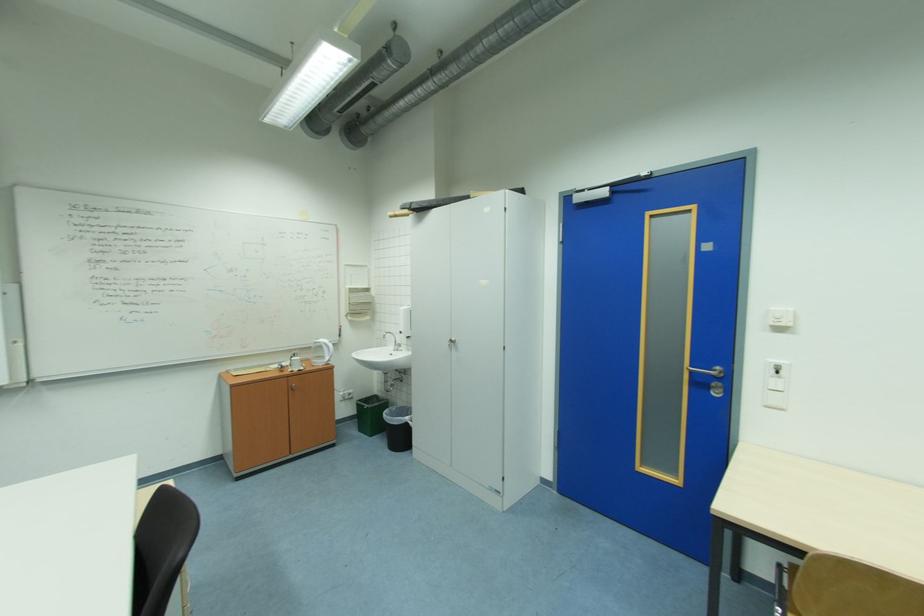
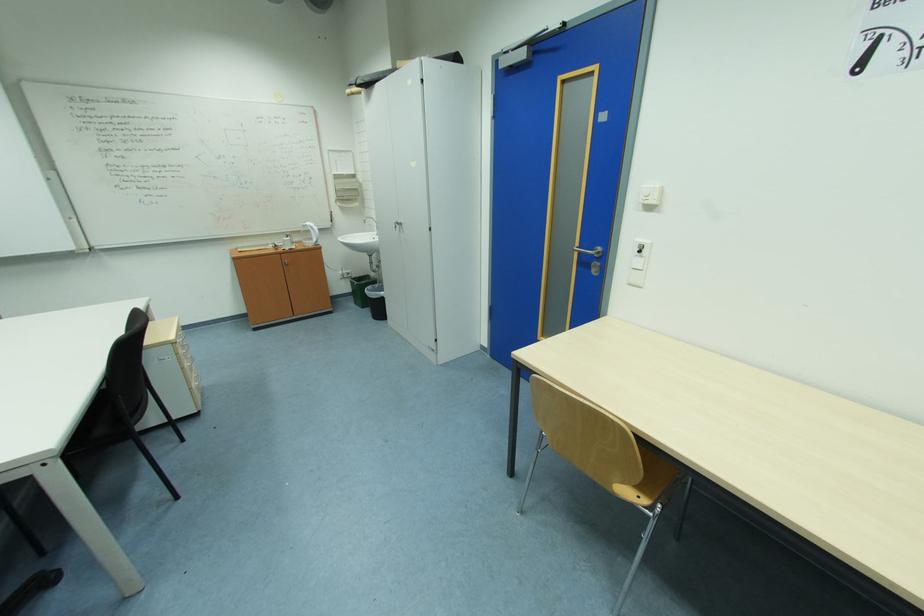
The point at [708,385] is marked in the first image. Where is the corresponding point in the second image?

(590, 264)